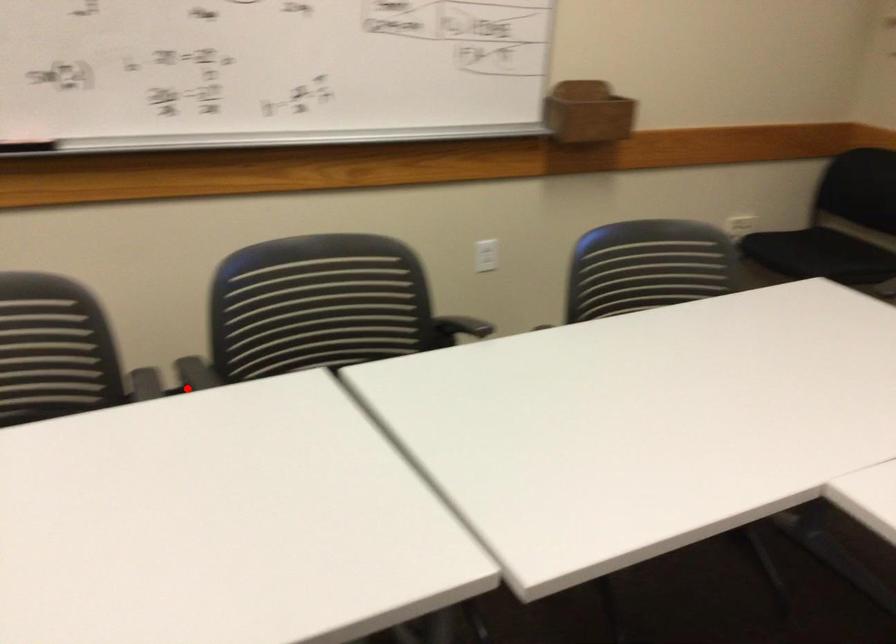
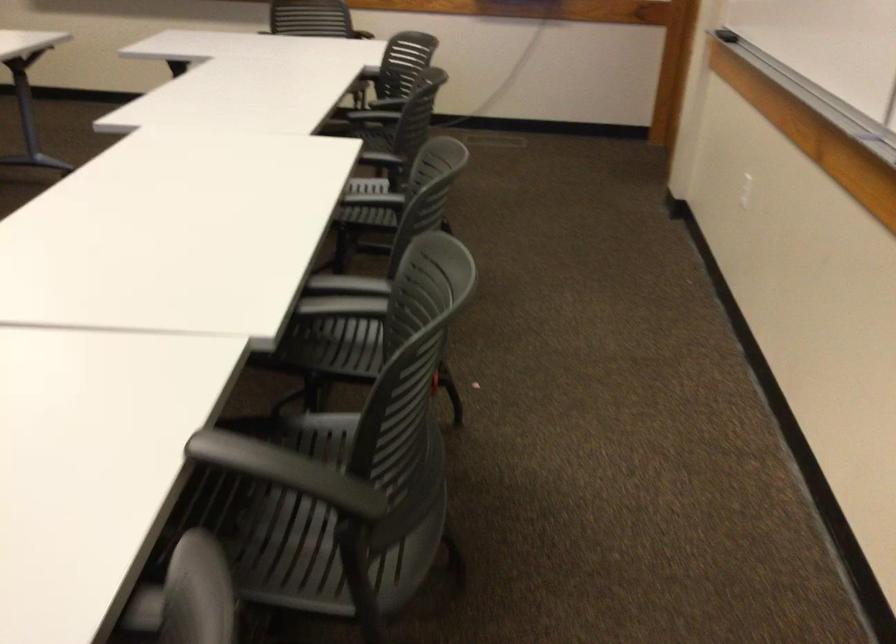
The point at the highlighted location is marked in the first image. Where is the corresponding point in the second image?

(343, 297)